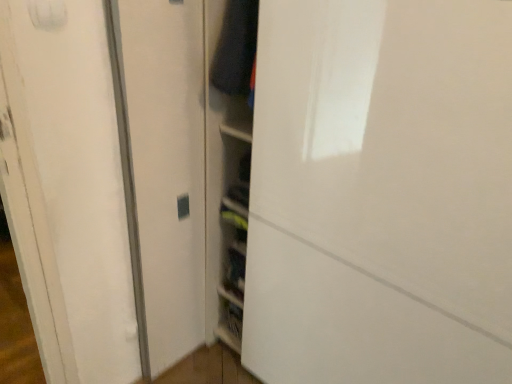
Locate an element on the screen. black fabric at center is located at coordinates (236, 48).

This screenshot has height=384, width=512. What do you see at coordinates (236, 48) in the screenshot?
I see `black fabric at center` at bounding box center [236, 48].

What are the coordinates of `black fabric at center` in the screenshot? It's located at (236, 48).